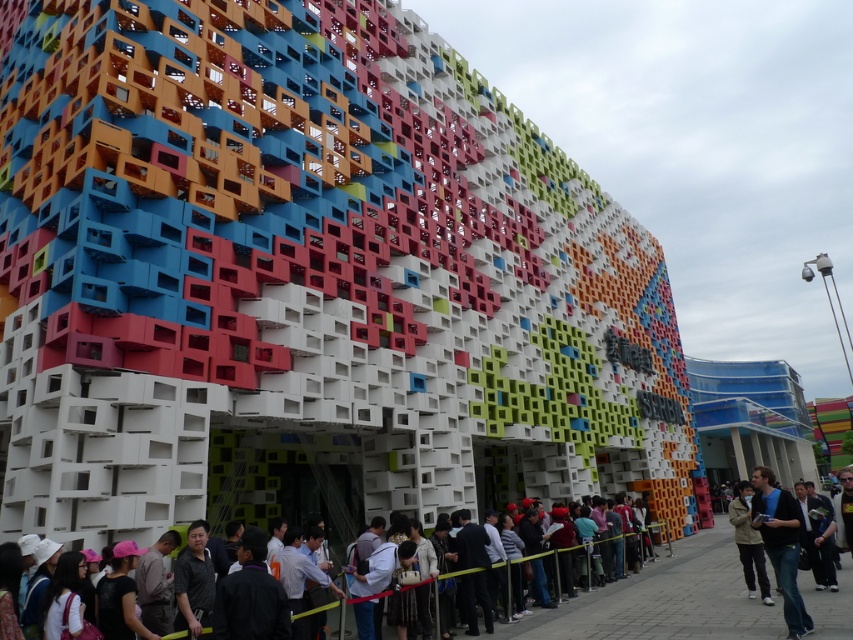
Question: Does dark gray suit at center have a smaller size compared to khaki cotton jacket at center?

Choices:
 (A) yes
 (B) no

Answer: (B)

Question: Does dark gray suit at center have a lesser width compared to khaki cotton jacket at center?

Choices:
 (A) no
 (B) yes

Answer: (A)

Question: Among these objects, which one is nearest to the camera?

Choices:
 (A) khaki cotton jacket at center
 (B) dark blue jeans at lower right
 (C) dark gray suit at center

Answer: (B)

Question: Which is farther from the khaki cotton jacket at center?

Choices:
 (A) dark gray suit at center
 (B) dark blue jeans at lower right

Answer: (A)

Question: Among these objects, which one is nearest to the camera?

Choices:
 (A) dark blue jeans at lower right
 (B) khaki cotton jacket at center

Answer: (A)

Question: Is dark blue jeans at lower right thinner than khaki cotton jacket at center?

Choices:
 (A) yes
 (B) no

Answer: (A)